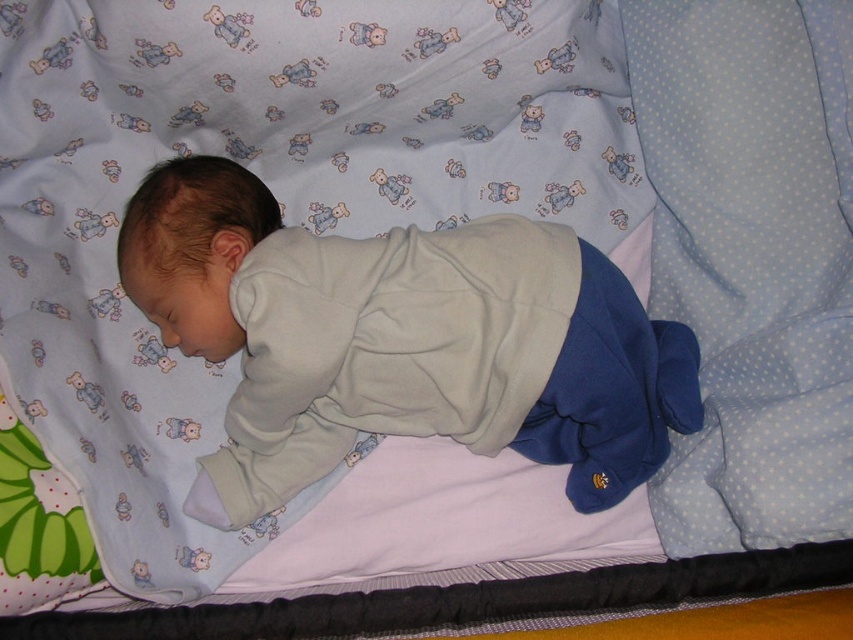
You are a caregiver checking on a baby in a crib. You see the light gray fleece baby at center and the light blue dotted pillow at right. Which object is positioned higher in the image?

The light blue dotted pillow at right is positioned higher than the light gray fleece baby at center.

In the scene shown: You are a nursery designer checking the crib dimensions. The crib is 60 cm wide. The light gray fleece baby at center and the light blue dotted pillow at right are inside. Can both fit side by side without overlapping?

The light gray fleece baby at center is wider than the light blue dotted pillow at right. Since the crib is 60 cm wide, the combined width of both items may exceed the crib width, so they might not fit side by side without overlapping.